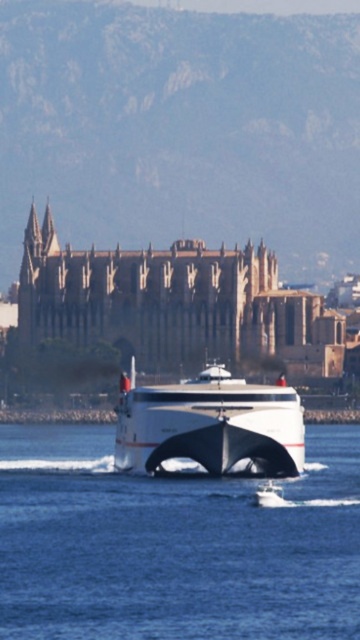
Question: Does clear blue water at center appear on the left side of white matte ship at center?

Choices:
 (A) yes
 (B) no

Answer: (B)

Question: Can you confirm if white matte ship at center is bigger than white glossy yacht at center?

Choices:
 (A) no
 (B) yes

Answer: (B)

Question: Which object appears closest to the camera in this image?

Choices:
 (A) white glossy yacht at center
 (B) white matte ship at center
 (C) clear blue water at center

Answer: (C)

Question: Estimate the real-world distances between objects in this image. Which object is closer to the white matte ship at center?

Choices:
 (A) white glossy yacht at center
 (B) clear blue water at center

Answer: (B)

Question: Which object appears farthest from the camera in this image?

Choices:
 (A) white matte ship at center
 (B) white glossy yacht at center
 (C) clear blue water at center

Answer: (A)

Question: Is white matte ship at center wider than white glossy yacht at center?

Choices:
 (A) no
 (B) yes

Answer: (B)